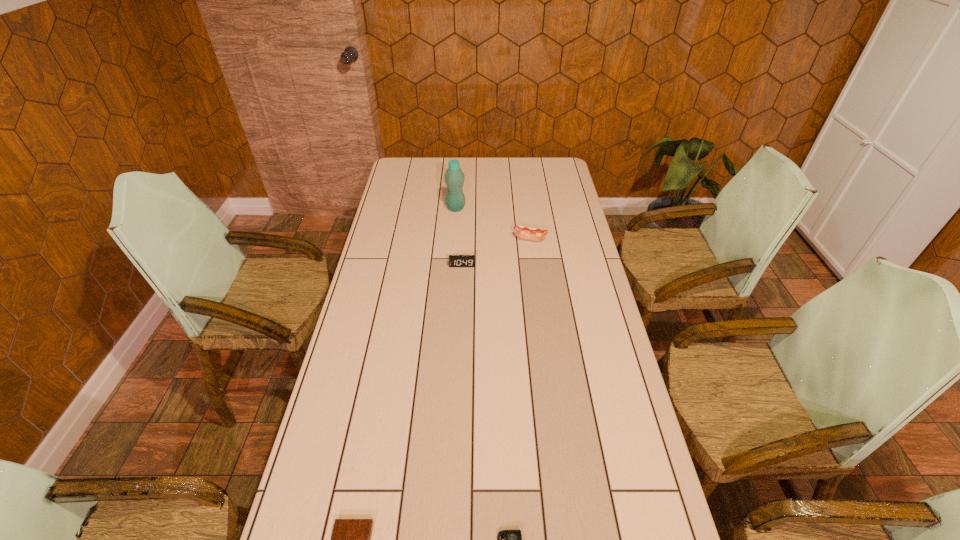
This screenshot has height=540, width=960. What are the coordinates of `water bottle` in the screenshot? It's located at (454, 177).

You are a GUI agent. You are given a task and a screenshot of the screen. Output one action in this format:
    pyautogui.click(x=<x>, y=<y>)
    Task: Click on the farthest object
    
    Given the screenshot: What is the action you would take?
    pyautogui.click(x=454, y=177)

Locate an element on the screen. Image resolution: width=960 pixels, height=540 pixels. the second farthest object is located at coordinates (521, 232).

This screenshot has height=540, width=960. I want to click on sausage, so click(521, 232).

Locate an element on the screen. This screenshot has height=540, width=960. the tallest alarm clock is located at coordinates (454, 260).

Locate an element on the screen. This screenshot has width=960, height=540. the third farthest object is located at coordinates (454, 260).

The height and width of the screenshot is (540, 960). What are the coordinates of `free region located at the front cap of the tallest object` in the screenshot? It's located at (497, 208).

Find the location of `vacant space located on the back of the sausage`. vacant space located on the back of the sausage is located at coordinates (528, 224).

Where is `free location located 0.190m on the front-facing side of the third nearest object`? This screenshot has height=540, width=960. free location located 0.190m on the front-facing side of the third nearest object is located at coordinates (460, 303).

Image resolution: width=960 pixels, height=540 pixels. I want to click on object that is at the right edge, so click(521, 232).